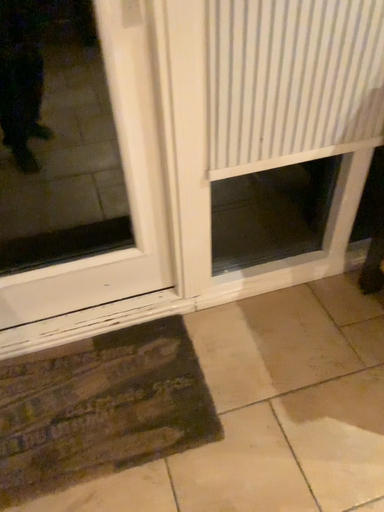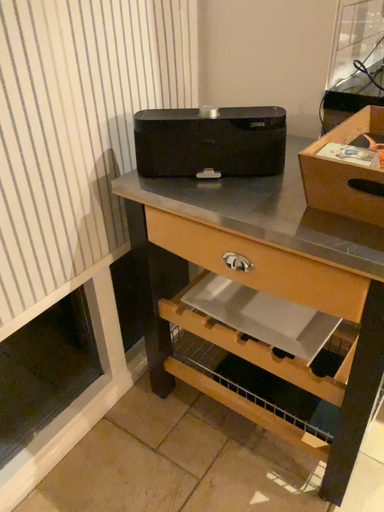
Question: Which way did the camera rotate in the video?

Choices:
 (A) rotated downward
 (B) rotated upward

Answer: (B)